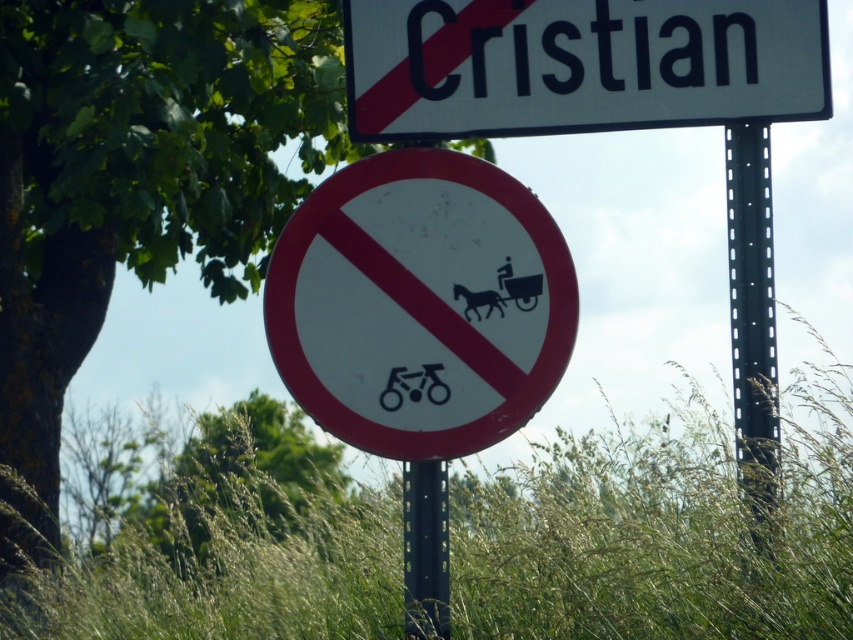
Can you confirm if black metal pole at right is positioned to the right of black matte bicycle at center?

Indeed, black metal pole at right is positioned on the right side of black matte bicycle at center.

Can you confirm if black metal pole at right is taller than black matte bicycle at center?

Correct, black metal pole at right is much taller as black matte bicycle at center.

Who is more distant from viewer, (x=729, y=209) or (x=434, y=388)?

The point (x=434, y=388) is more distant.

Identify the location of black metal pole at right. The width and height of the screenshot is (853, 640). (752, 323).

Is black metal pole at right below black metal pole at center?

No.

Who is more forward, (759,298) or (430,538)?

Point (759,298)

The image size is (853, 640). Find the location of `black metal pole at right`. black metal pole at right is located at coordinates (752, 323).

Does white plastic sign at upper center appear on the right side of black metal pole at center?

Indeed, white plastic sign at upper center is positioned on the right side of black metal pole at center.

Which is above, white plastic sign at upper center or black metal pole at center?

white plastic sign at upper center is above.

Where is `white plastic sign at upper center`? This screenshot has width=853, height=640. white plastic sign at upper center is located at coordinates (579, 65).